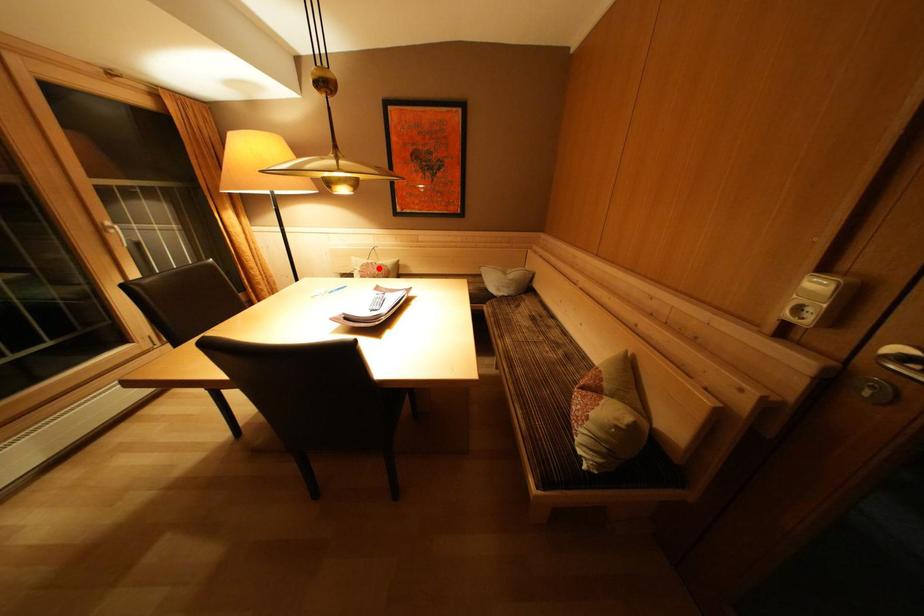
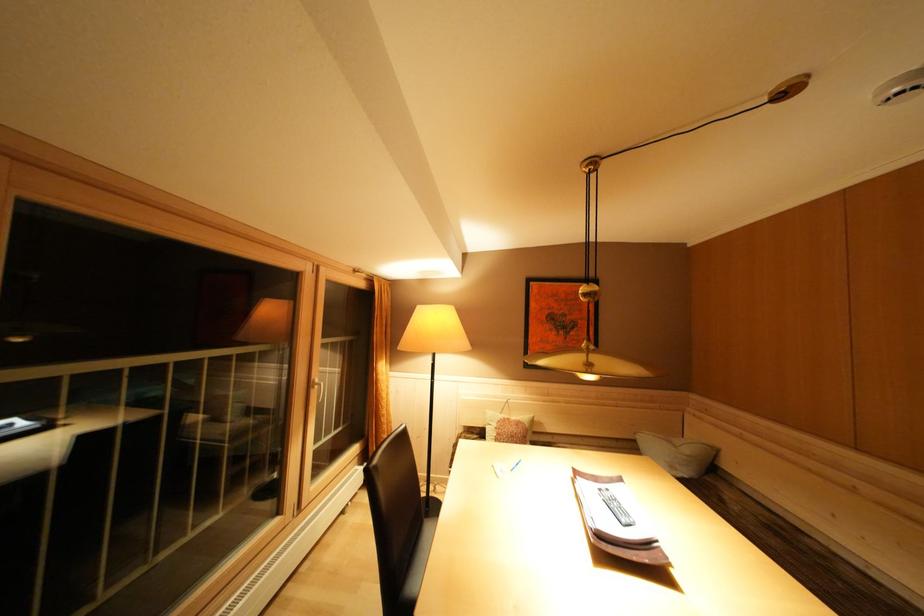
Question: I am providing you with two images of the same scene from different viewpoints. A red point is shown in image1. For the corresponding object point in image2, is it positioned nearer or farther from the camera?

Choices:
 (A) Nearer
 (B) Farther

Answer: (B)